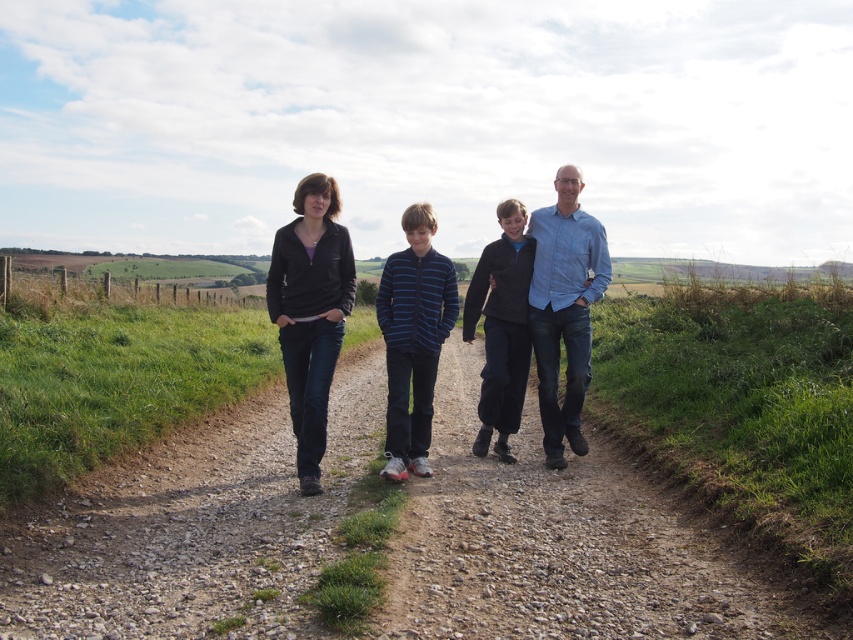
Question: Estimate the real-world distances between objects in this image. Which object is closer to the blue striped sweater at center?

Choices:
 (A) dark blue jeans at center
 (B) dark blue fleece jacket at center

Answer: (A)

Question: In this image, where is blue striped sweater at center located relative to dark blue fleece jacket at center?

Choices:
 (A) left
 (B) right

Answer: (A)

Question: Based on their relative distances, which object is nearer to the blue striped sweater at center?

Choices:
 (A) dark blue jeans at center
 (B) dark blue fleece jacket at center

Answer: (A)

Question: Can you confirm if dark blue jeans at center is positioned to the left of dark blue fleece jacket at center?

Choices:
 (A) yes
 (B) no

Answer: (A)

Question: Is dark blue jeans at center further to camera compared to blue striped sweater at center?

Choices:
 (A) yes
 (B) no

Answer: (B)

Question: Which of the following is the farthest from the observer?

Choices:
 (A) (505, 307)
 (B) (389, 472)
 (C) (440, 330)

Answer: (A)